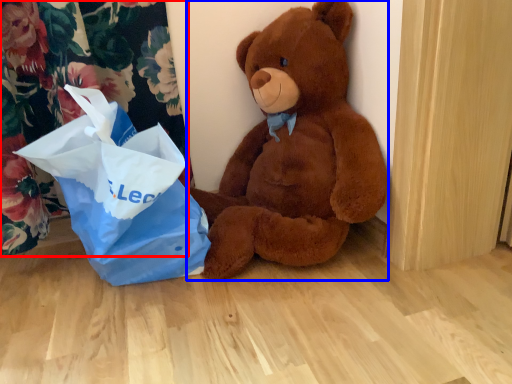
Question: Which object appears closest to the camera in this image, curtain (highlighted by a red box) or teddy bear (highlighted by a blue box)?

Choices:
 (A) curtain
 (B) teddy bear

Answer: (B)